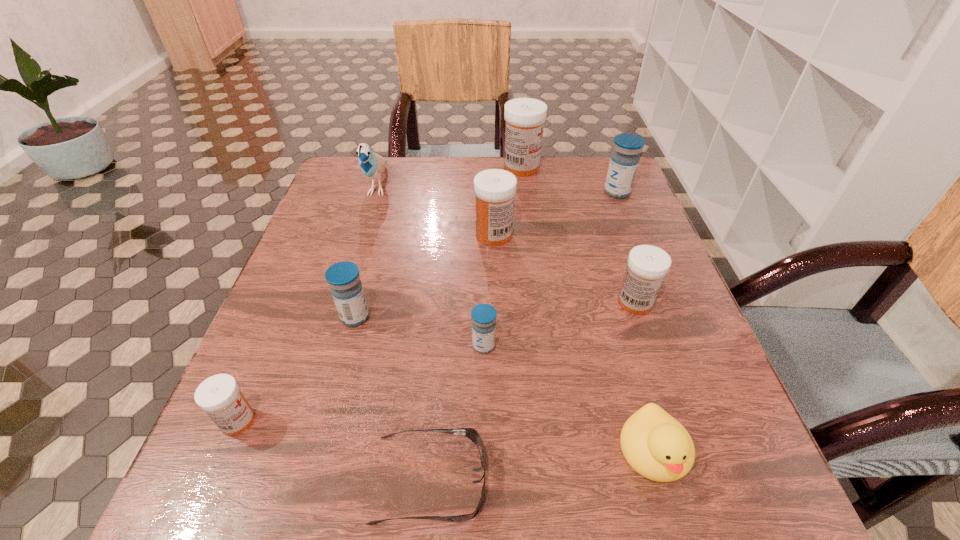
You are a GUI agent. You are given a task and a screenshot of the screen. Output one action in this format:
    pyautogui.click(x=<x>, y=<y>)
    Task: Click on the vacant space situated on the front of the seventh nearest object
    The width and height of the screenshot is (960, 540).
    Given the screenshot: What is the action you would take?
    pyautogui.click(x=496, y=294)

Where is `blank space located 0.370m on the left of the third farthest white medicine`? blank space located 0.370m on the left of the third farthest white medicine is located at coordinates (433, 302).

Locate an element on the screen. The image size is (960, 540). vacant space located 0.360m on the right of the second farthest blue medicine is located at coordinates (554, 317).

Identify the location of vacant area situated on the front of the nearest blue medicine. (485, 525).

Identify the location of vacant space located 0.380m on the right of the smallest white medicine. This screenshot has width=960, height=540. (492, 421).

Where is `vacant space situated 0.050m on the front-facing side of the sunglasses`? vacant space situated 0.050m on the front-facing side of the sunglasses is located at coordinates (519, 479).

Locate an element on the screen. This screenshot has width=960, height=540. bird present at the far edge is located at coordinates coord(372,165).

Find the location of a particular element. This screenshot has height=540, width=960. duckling that is at the near edge is located at coordinates pos(658,447).

Locate an element on the screen. This screenshot has width=960, height=540. sunglasses that is at the near edge is located at coordinates (471, 433).

The image size is (960, 540). I want to click on bird that is at the left edge, so pos(372,165).